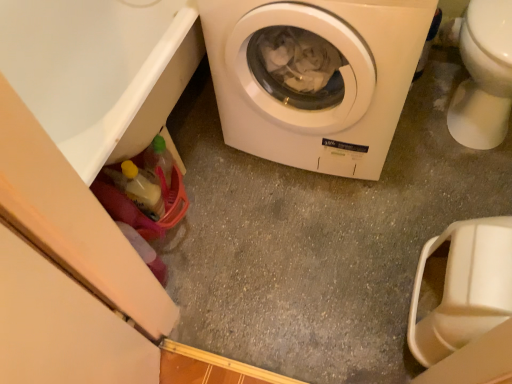
Question: Is white glossy toilet bowl at right shorter than white matte washing machine at center?

Choices:
 (A) yes
 (B) no

Answer: (A)

Question: Is white glossy toilet bowl at right not inside white matte washing machine at center?

Choices:
 (A) no
 (B) yes

Answer: (B)

Question: Considering the relative sizes of white glossy toilet bowl at right and white matte washing machine at center in the image provided, is white glossy toilet bowl at right smaller than white matte washing machine at center?

Choices:
 (A) no
 (B) yes

Answer: (B)

Question: From the image's perspective, would you say white glossy toilet bowl at right is positioned over white matte washing machine at center?

Choices:
 (A) yes
 (B) no

Answer: (A)

Question: Does white glossy toilet bowl at right appear on the right side of white matte washing machine at center?

Choices:
 (A) no
 (B) yes

Answer: (B)

Question: Could you tell me if white glossy toilet bowl at right is facing white matte washing machine at center?

Choices:
 (A) yes
 (B) no

Answer: (B)

Question: Does white matte washing machine at center have a smaller size compared to white glossy toilet bowl at right?

Choices:
 (A) yes
 (B) no

Answer: (B)

Question: From the image's perspective, is white matte washing machine at center on top of white glossy toilet bowl at right?

Choices:
 (A) no
 (B) yes

Answer: (A)

Question: Could you tell me if white matte washing machine at center is turned towards white glossy toilet bowl at right?

Choices:
 (A) yes
 (B) no

Answer: (B)

Question: Is white matte washing machine at center with white glossy toilet bowl at right?

Choices:
 (A) no
 (B) yes

Answer: (A)

Question: Is white matte washing machine at center to the left of white glossy toilet bowl at right from the viewer's perspective?

Choices:
 (A) yes
 (B) no

Answer: (A)

Question: Can white glossy toilet bowl at right be found inside white matte washing machine at center?

Choices:
 (A) no
 (B) yes

Answer: (A)

Question: Which is correct: white glossy toilet bowl at right is inside white matte washing machine at center, or outside of it?

Choices:
 (A) inside
 (B) outside

Answer: (B)